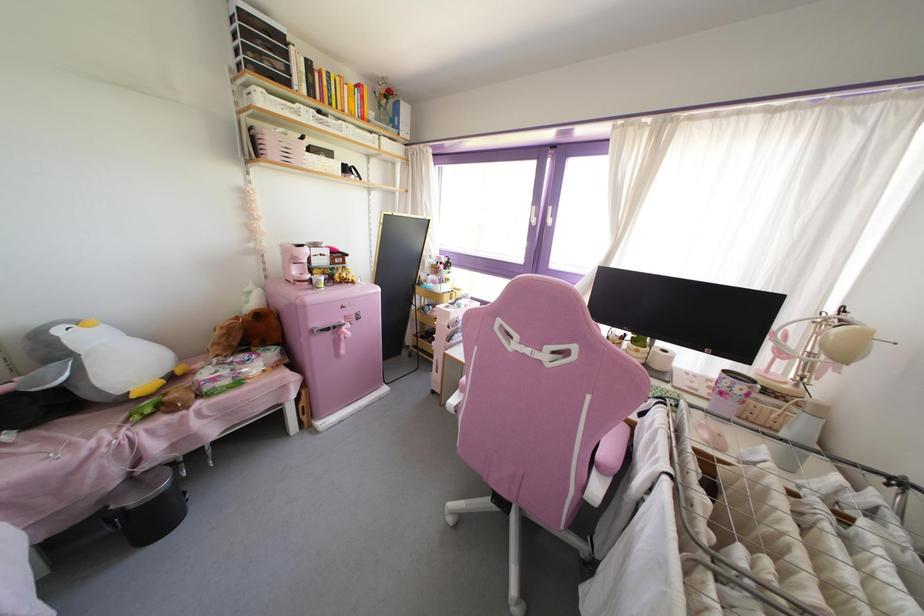
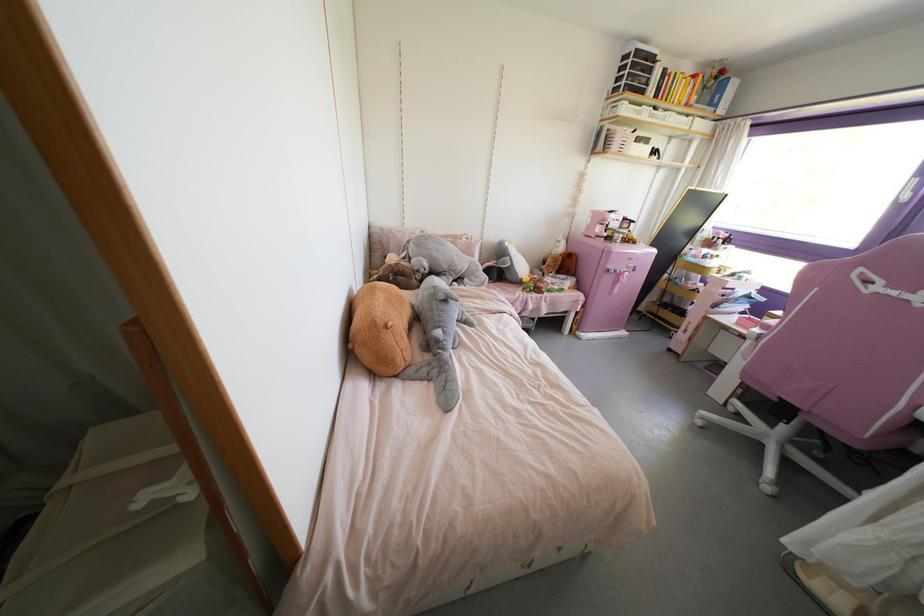
Where in the second image is the point corresponding to [134,395] from the first image?

(523, 280)